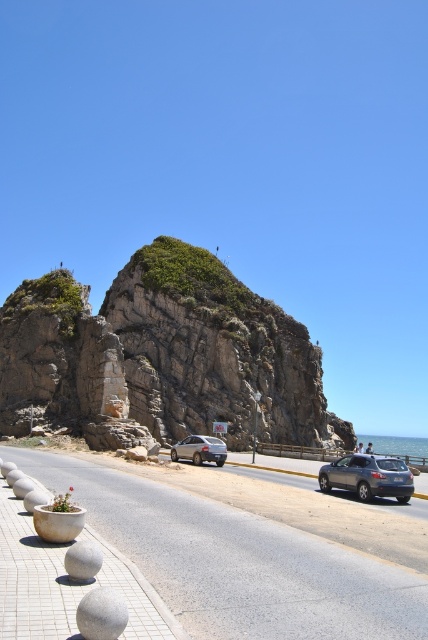
You are a tourist standing on the sidewalk next to the road. You want to take a photo of the rocky cliff at upper center without the satin silver sedan at center blocking the view. Where should you position yourself relative to the sedan?

To avoid the satin silver sedan at center blocking the view of the rocky cliff at upper center, you should position yourself behind the sedan, as the cliff is located above the sedan and positioning behind would allow you to see the cliff without obstruction.

You are a photographer planning to capture a wide shot of the rocky cliff at upper center and the satin silver sedan at center. Given the size difference between them, which object should you position closer to the camera to ensure both appear balanced in the frame?

Since the rocky cliff at upper center is larger than the satin silver sedan at center, you should position the satin silver sedan at center closer to the camera to balance their sizes in the photograph.

You are standing on the gray stone at lower left and want to reach the rocky cliff at upper center. Which direction should you move to get there?

To reach the rocky cliff at upper center from the gray stone at lower left, you should move upward since the rocky cliff at upper center is above the gray stone at lower left.